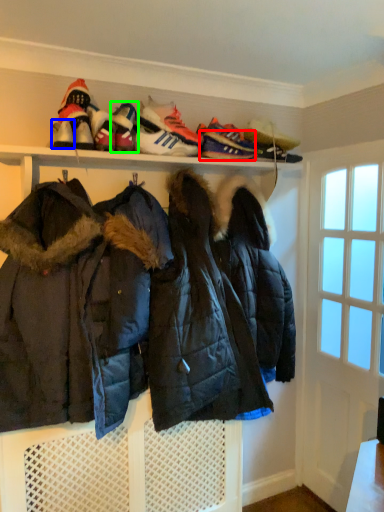
Question: Which object is the closest to the shoe (highlighted by a red box)? Choose among these: shoe (highlighted by a blue box) or footwear (highlighted by a green box).

Choices:
 (A) shoe
 (B) footwear

Answer: (B)